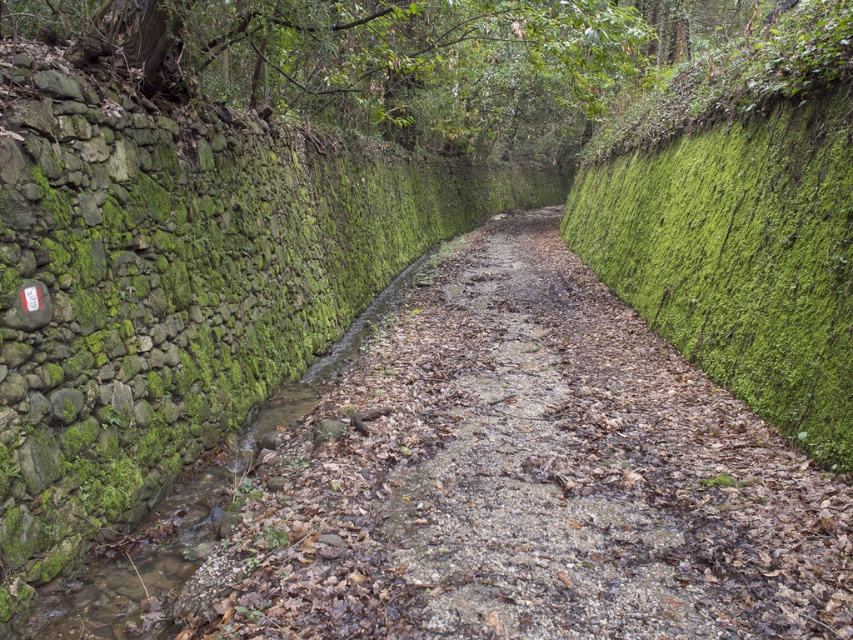
Does point (820, 438) come behind point (126, 624)?

Yes, point (820, 438) is behind point (126, 624).

Which is in front, point (659, 113) or point (152, 541)?

Point (152, 541) is in front.

Locate an element on the screen. The width and height of the screenshot is (853, 640). green mossy hedge at right is located at coordinates (740, 220).